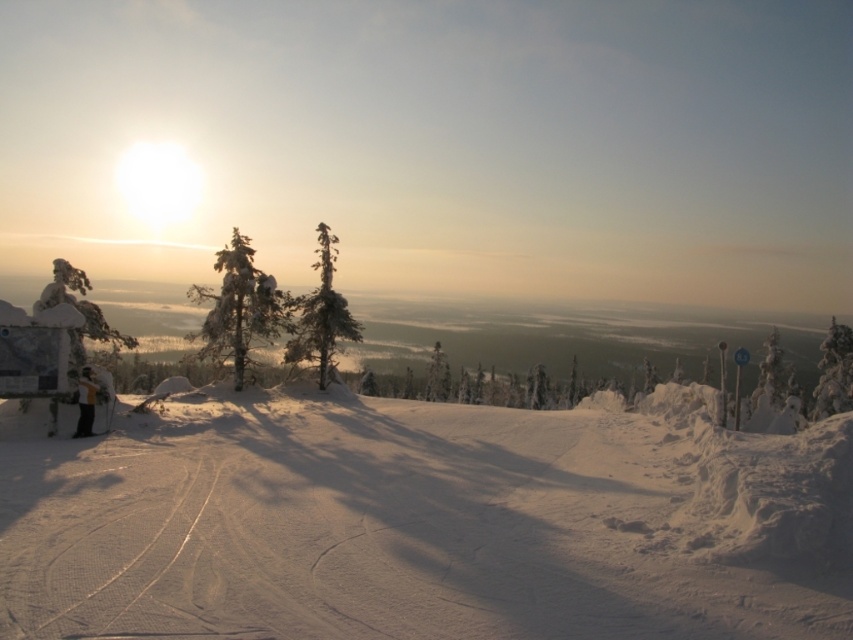
You are standing at the bottom of the slope in the winter landscape image. You see two points marked as point 1 at coordinates [212,348] and point 2 at coordinates [786,387]. Which point is closer to you?

Point 1 at coordinates [212,348] is closer to you than point 2 at coordinates [786,387].

You are a photographer trying to capture the green matte tree at center and the black matte ski at lower left in a single frame. Given that your camera can only focus on objects within a 100cm height range, will both objects fit within this range?

The green matte tree at center is taller than the black matte ski at lower left, but without specific height measurements, it is impossible to determine if their height difference falls within the 100cm range. Additional information is needed.